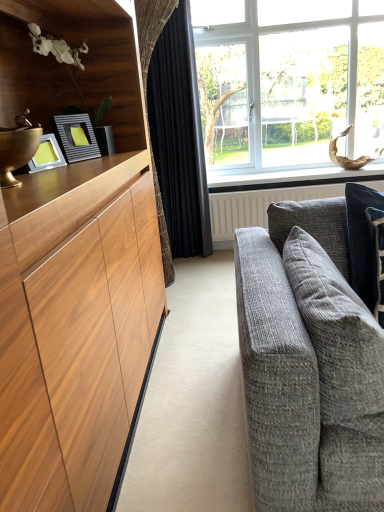
Question: Can you confirm if clear glass window at upper right is positioned to the right of white painted wood at upper center?

Choices:
 (A) no
 (B) yes

Answer: (A)

Question: Does clear glass window at upper right touch white painted wood at upper center?

Choices:
 (A) yes
 (B) no

Answer: (B)

Question: Does clear glass window at upper right lie behind white painted wood at upper center?

Choices:
 (A) no
 (B) yes

Answer: (A)

Question: Considering the relative sizes of clear glass window at upper right and white painted wood at upper center in the image provided, is clear glass window at upper right thinner than white painted wood at upper center?

Choices:
 (A) yes
 (B) no

Answer: (B)

Question: Could you tell me if clear glass window at upper right is facing white painted wood at upper center?

Choices:
 (A) yes
 (B) no

Answer: (B)

Question: Considering the relative sizes of clear glass window at upper right and white painted wood at upper center in the image provided, is clear glass window at upper right taller than white painted wood at upper center?

Choices:
 (A) yes
 (B) no

Answer: (A)

Question: Is white textured radiator at center far from dark blue textured pillow at right, acting as the 2th pillow starting from the left?

Choices:
 (A) yes
 (B) no

Answer: (A)

Question: Is white textured radiator at center wider than dark blue textured pillow at right, the 1th pillow in the right-to-left sequence?

Choices:
 (A) no
 (B) yes

Answer: (A)

Question: Does white textured radiator at center appear on the right side of dark blue textured pillow at right, acting as the 2th pillow starting from the left?

Choices:
 (A) no
 (B) yes

Answer: (B)

Question: Is white textured radiator at center located outside dark blue textured pillow at right, the 1th pillow in the right-to-left sequence?

Choices:
 (A) no
 (B) yes

Answer: (B)

Question: Considering the relative positions of white textured radiator at center and dark blue textured pillow at right, the 1th pillow in the right-to-left sequence, in the image provided, is white textured radiator at center to the left of dark blue textured pillow at right, the 1th pillow in the right-to-left sequence, from the viewer's perspective?

Choices:
 (A) yes
 (B) no

Answer: (B)

Question: Does white textured radiator at center have a larger size compared to dark blue textured pillow at right, the 1th pillow in the right-to-left sequence?

Choices:
 (A) yes
 (B) no

Answer: (A)

Question: Is white textured radiator at center positioned far away from white painted wood at upper center?

Choices:
 (A) yes
 (B) no

Answer: (B)